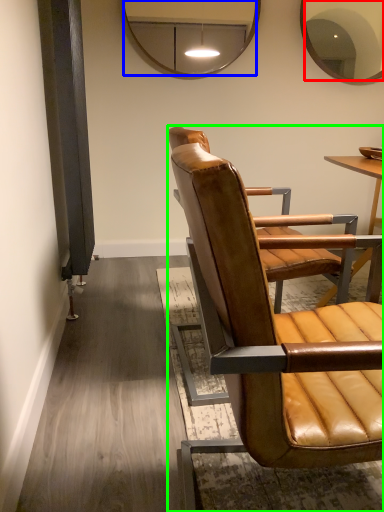
Question: Based on their relative distances, which object is farther from mirror (highlighted by a red box)? Choose from mirror (highlighted by a blue box) and chair (highlighted by a green box).

Choices:
 (A) mirror
 (B) chair

Answer: (B)